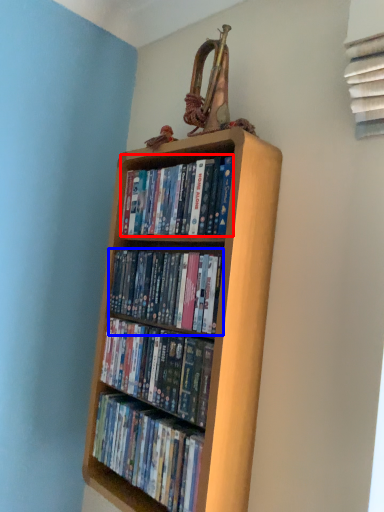
Question: Which of the following is the farthest to the observer, book (highlighted by a red box) or book (highlighted by a blue box)?

Choices:
 (A) book
 (B) book

Answer: (A)